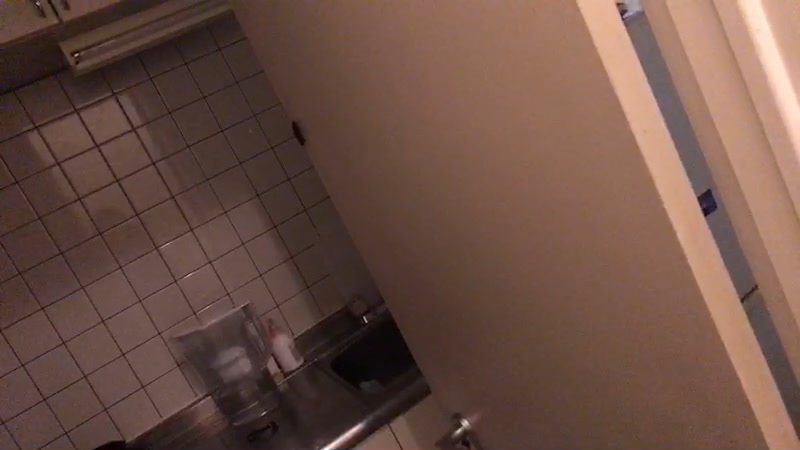
This screenshot has width=800, height=450. What are the coordinates of `cabinet handle` in the screenshot? It's located at (44, 11), (64, 6).